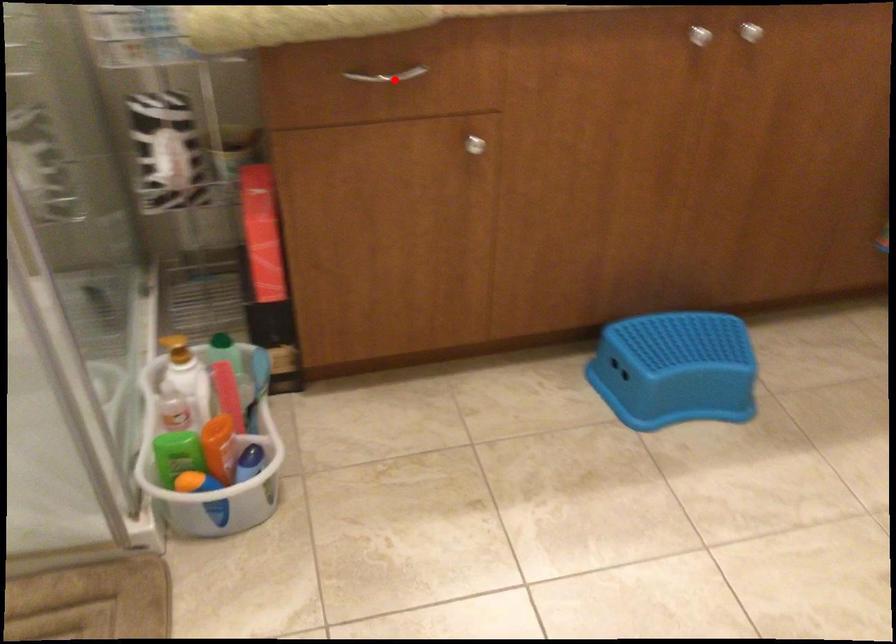
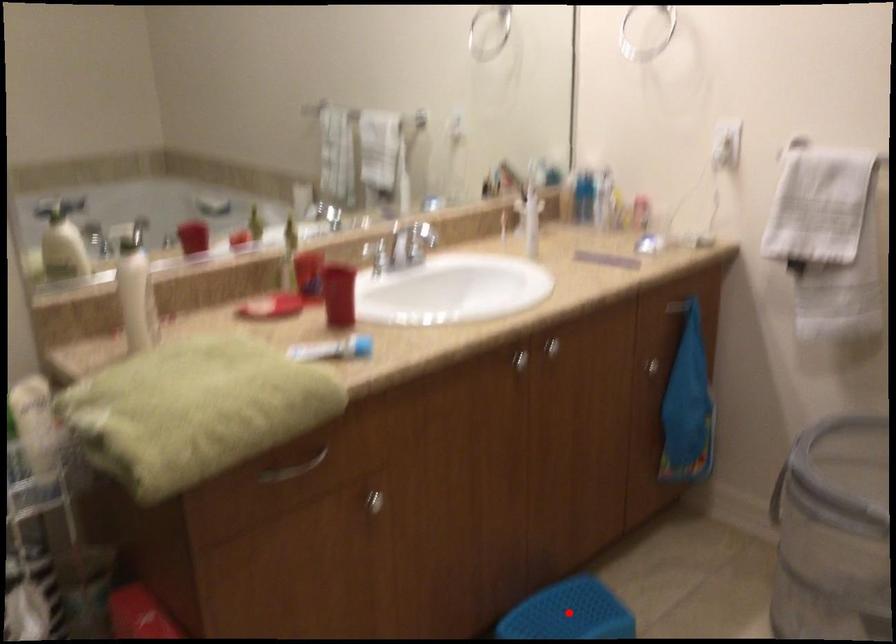
I am providing you with two images of the same scene from different viewpoints. A red point is marked on the first image and another point is marked on the second image. Is the marked point in image1 the same physical position as the marked point in image2?

No